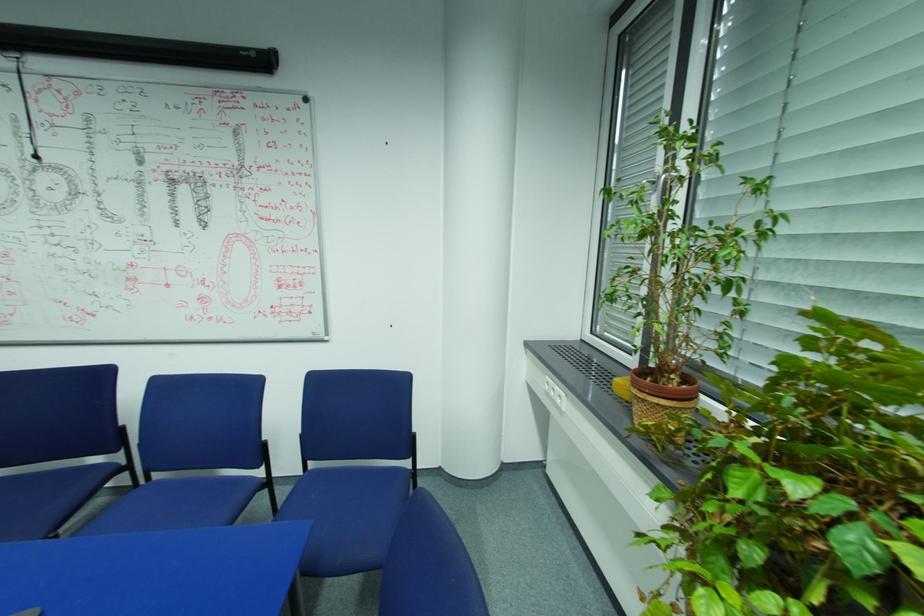
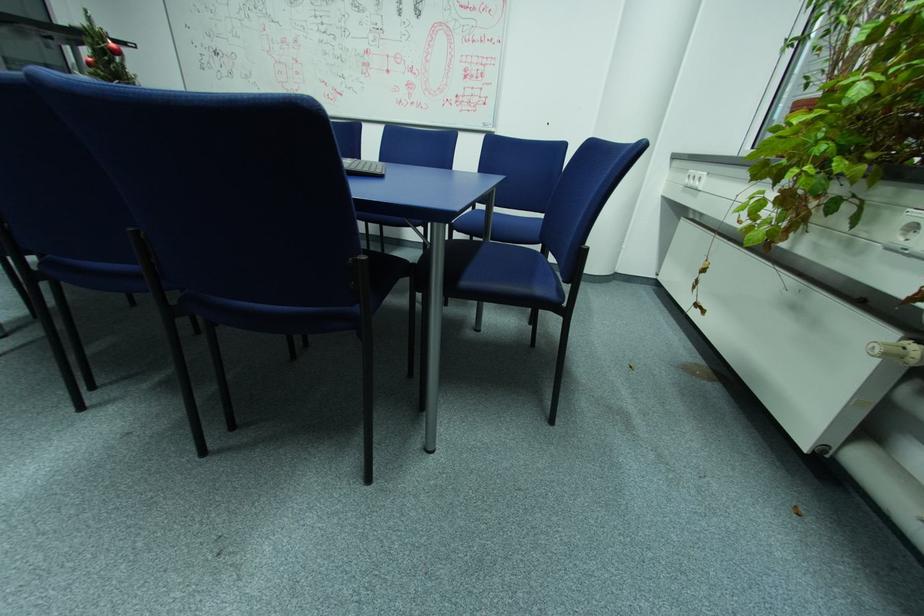
Question: The images are taken continuously from a first-person perspective. In which direction are you moving?

Choices:
 (A) Left
 (B) Right
 (C) Forward
 (D) Backward

Answer: (D)